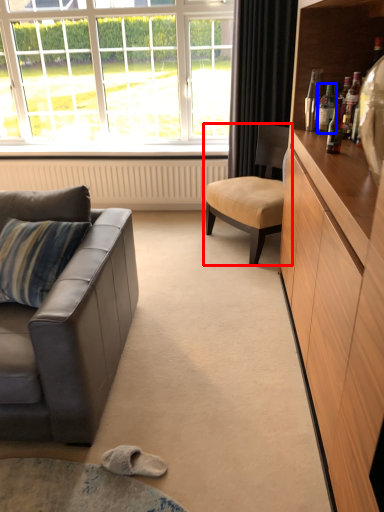
Question: Which object is further to the camera taking this photo, chair (highlighted by a red box) or bottle (highlighted by a blue box)?

Choices:
 (A) chair
 (B) bottle

Answer: (A)